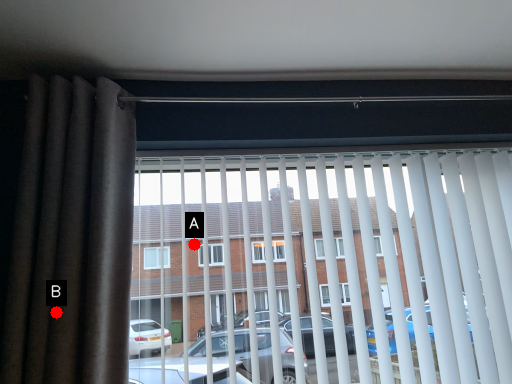
Question: Two points are circled on the image, labeled by A and B beside each circle. Among these points, which one is nearest to the camera?

Choices:
 (A) A is closer
 (B) B is closer

Answer: (B)